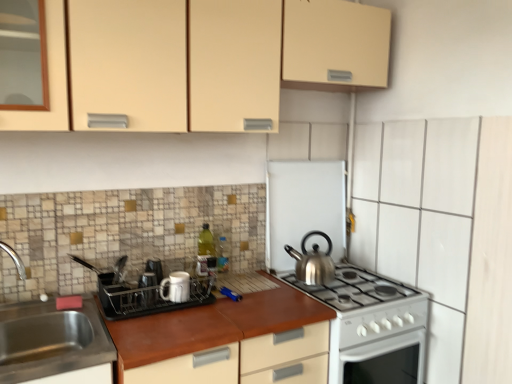
Where is `vacant area that is situated to the right of white matte dish rack at center, the 3th appliance in the back-to-front sequence`? The height and width of the screenshot is (384, 512). vacant area that is situated to the right of white matte dish rack at center, the 3th appliance in the back-to-front sequence is located at coordinates 240,306.